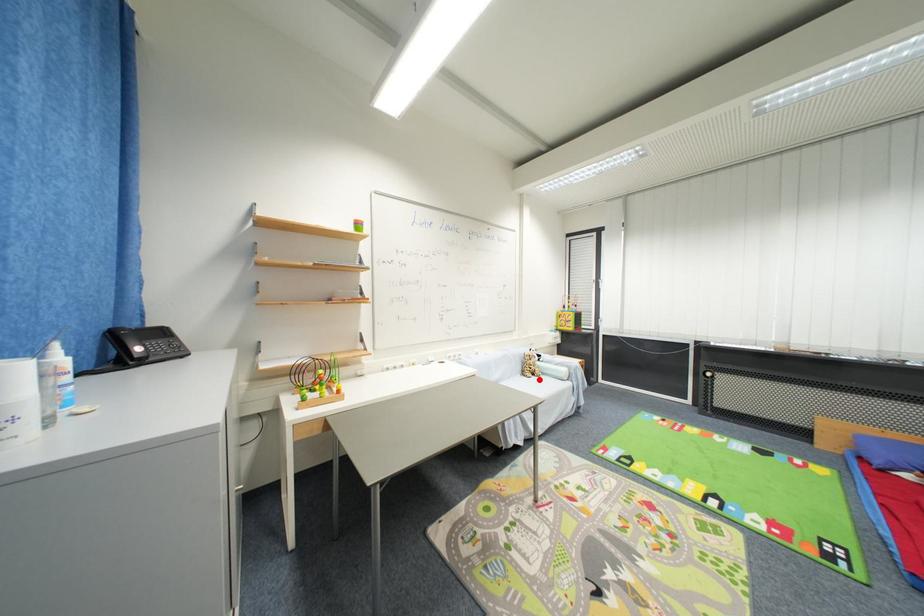
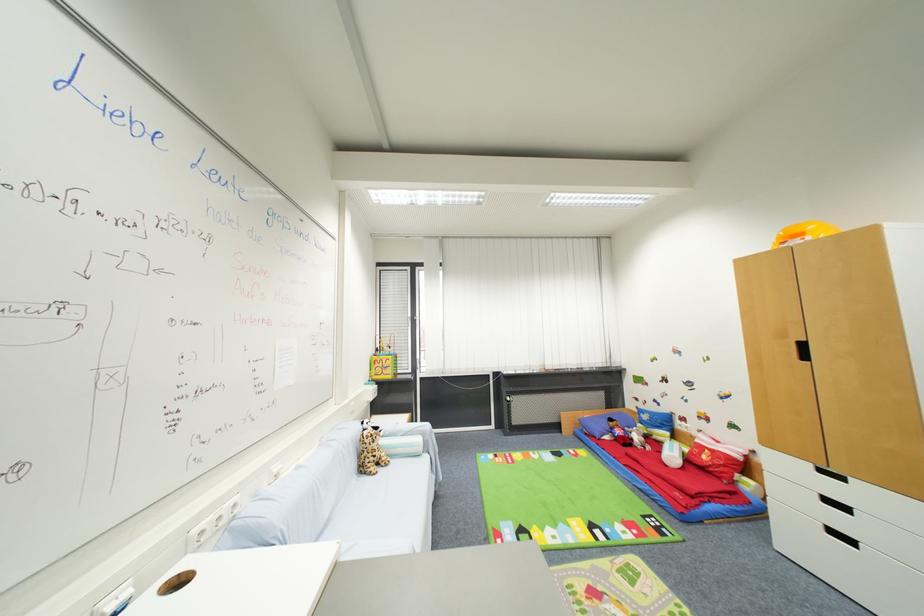
Locate, in the second image, the point that corresponds to the highlighted location in the first image.

(385, 472)